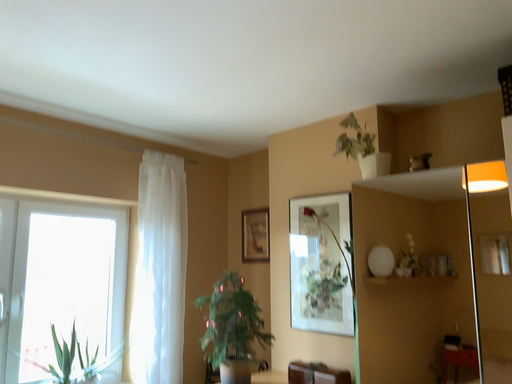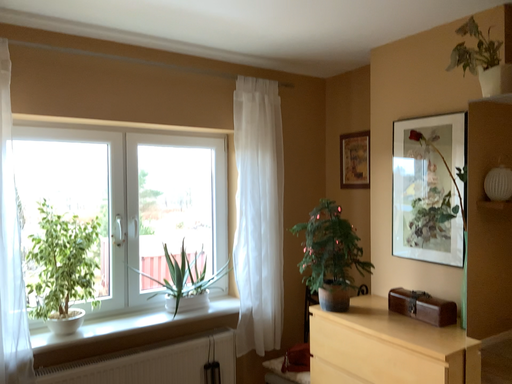
Question: Which way did the camera rotate in the video?

Choices:
 (A) rotated upward
 (B) rotated downward

Answer: (B)